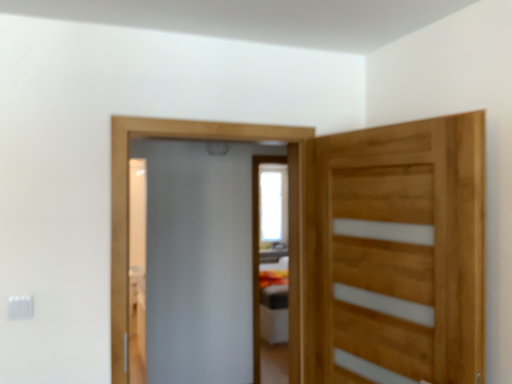
Describe the element at coordinates (199, 260) in the screenshot. I see `frosted glass screen door at center, the second screen door from the back` at that location.

In order to click on white glossy screen door at center, which is the first screen door from back to front in this screenshot , I will do `click(258, 256)`.

Image resolution: width=512 pixels, height=384 pixels. What are the coordinates of `frosted glass screen door at center, the 1th screen door positioned from the front` in the screenshot? It's located at (199, 260).

Could you tell me if frosted glass screen door at center, the 1th screen door positioned from the front, is facing white glossy screen door at center, the second screen door positioned from the front?

No, frosted glass screen door at center, the 1th screen door positioned from the front, is not facing towards white glossy screen door at center, the second screen door positioned from the front.

Which is in front, point (157, 368) or point (255, 346)?

The point (157, 368) is in front.

Which object is positioned more to the right, frosted glass screen door at center, the 1th screen door positioned from the front, or white glossy screen door at center, the second screen door positioned from the front?

white glossy screen door at center, the second screen door positioned from the front, is more to the right.

Is frosted glass screen door at center, the second screen door from the back, outside of white glossy screen door at center, which is the first screen door from back to front?

Yes.

Which object is wider, natural wood door at right or frosted glass screen door at center, the second screen door from the back?

frosted glass screen door at center, the second screen door from the back.

What's the angular difference between natural wood door at right and frosted glass screen door at center, the second screen door from the back,'s facing directions?

The angle between the facing direction of natural wood door at right and the facing direction of frosted glass screen door at center, the second screen door from the back, is 103 degrees.

Would you say frosted glass screen door at center, the second screen door from the back, is part of natural wood door at right's contents?

Actually, frosted glass screen door at center, the second screen door from the back, is outside natural wood door at right.

Is natural wood door at right oriented away from frosted glass screen door at center, the second screen door from the back?

No.

Between white glossy screen door at center, the second screen door positioned from the front, and natural wood door at right, which one has more height?

white glossy screen door at center, the second screen door positioned from the front.

From a real-world perspective, is white glossy screen door at center, which is the first screen door from back to front, positioned above or below natural wood door at right?

white glossy screen door at center, which is the first screen door from back to front, is below natural wood door at right.

Considering the sizes of white glossy screen door at center, the second screen door positioned from the front, and natural wood door at right in the image, is white glossy screen door at center, the second screen door positioned from the front, wider or thinner than natural wood door at right?

In the image, white glossy screen door at center, the second screen door positioned from the front, appears to be wider than natural wood door at right.

Which object is further away from the camera taking this photo, white glossy screen door at center, the second screen door positioned from the front, or natural wood door at right?

white glossy screen door at center, the second screen door positioned from the front, is further from the camera.

Considering the relative sizes of natural wood door at right and white glossy screen door at center, the second screen door positioned from the front, in the image provided, is natural wood door at right bigger than white glossy screen door at center, the second screen door positioned from the front,?

Actually, natural wood door at right might be smaller than white glossy screen door at center, the second screen door positioned from the front.

Which object is positioned more to the left, natural wood door at right or white glossy screen door at center, the second screen door positioned from the front?

Positioned to the left is white glossy screen door at center, the second screen door positioned from the front.

Can you see natural wood door at right touching white glossy screen door at center, which is the first screen door from back to front?

No, natural wood door at right is not in contact with white glossy screen door at center, which is the first screen door from back to front.

From the image's perspective, between natural wood door at right and white glossy screen door at center, the second screen door positioned from the front, which one is located above?

natural wood door at right is shown above in the image.

Is frosted glass screen door at center, the second screen door from the back, looking in the opposite direction of natural wood door at right?

Absolutely, frosted glass screen door at center, the second screen door from the back, is directed away from natural wood door at right.

Which is nearer, (161, 240) or (471, 228)?

Point (471, 228)

Between frosted glass screen door at center, the second screen door from the back, and natural wood door at right, which one has larger width?

With larger width is frosted glass screen door at center, the second screen door from the back.

From a real-world perspective, is white glossy screen door at center, the second screen door positioned from the front, positioned above or below frosted glass screen door at center, the second screen door from the back?

From a real-world perspective, white glossy screen door at center, the second screen door positioned from the front, is physically below frosted glass screen door at center, the second screen door from the back.

This screenshot has width=512, height=384. In order to click on screen door behind the frosted glass screen door at center, the second screen door from the back in this screenshot , I will do `click(258, 256)`.

In the image, is white glossy screen door at center, which is the first screen door from back to front, positioned in front of or behind frosted glass screen door at center, the 1th screen door positioned from the front?

In the image, white glossy screen door at center, which is the first screen door from back to front, appears behind frosted glass screen door at center, the 1th screen door positioned from the front.

How many degrees apart are the facing directions of white glossy screen door at center, which is the first screen door from back to front, and frosted glass screen door at center, the 1th screen door positioned from the front?

121 degrees separate the facing orientations of white glossy screen door at center, which is the first screen door from back to front, and frosted glass screen door at center, the 1th screen door positioned from the front.

Image resolution: width=512 pixels, height=384 pixels. In order to click on screen door below the frosted glass screen door at center, the 1th screen door positioned from the front (from the image's perspective) in this screenshot , I will do `click(258, 256)`.

Where is `screen door that is the 1st object directly below the natural wood door at right (from a real-world perspective)`? The height and width of the screenshot is (384, 512). screen door that is the 1st object directly below the natural wood door at right (from a real-world perspective) is located at coordinates (199, 260).

Looking at the image, which one is located further to white glossy screen door at center, which is the first screen door from back to front, frosted glass screen door at center, the 1th screen door positioned from the front, or natural wood door at right?

natural wood door at right is further to white glossy screen door at center, which is the first screen door from back to front.

From the image, which object appears to be farther from frosted glass screen door at center, the 1th screen door positioned from the front, natural wood door at right or white glossy screen door at center, the second screen door positioned from the front?

natural wood door at right lies further to frosted glass screen door at center, the 1th screen door positioned from the front, than the other object.

Looking at the image, which one is located closer to natural wood door at right, white glossy screen door at center, the second screen door positioned from the front, or frosted glass screen door at center, the second screen door from the back?

The object closer to natural wood door at right is frosted glass screen door at center, the second screen door from the back.

When comparing their distances from frosted glass screen door at center, the second screen door from the back, does white glossy screen door at center, which is the first screen door from back to front, or natural wood door at right seem closer?

Among the two, white glossy screen door at center, which is the first screen door from back to front, is located nearer to frosted glass screen door at center, the second screen door from the back.

Looking at the image, which one is located closer to natural wood door at right, frosted glass screen door at center, the second screen door from the back, or white glossy screen door at center, which is the first screen door from back to front?

Among the two, frosted glass screen door at center, the second screen door from the back, is located nearer to natural wood door at right.

Estimate the real-world distances between objects in this image. Which object is further from white glossy screen door at center, which is the first screen door from back to front, natural wood door at right or frosted glass screen door at center, the 1th screen door positioned from the front?

Based on the image, natural wood door at right appears to be further to white glossy screen door at center, which is the first screen door from back to front.

You are a GUI agent. You are given a task and a screenshot of the screen. Output one action in this format:
    pyautogui.click(x=<x>, y=<y>)
    Task: Click on the screen door between natural wood door at right and white glossy screen door at center, the second screen door positioned from the front, from front to back
    Image resolution: width=512 pixels, height=384 pixels.
    Given the screenshot: What is the action you would take?
    pyautogui.click(x=199, y=260)